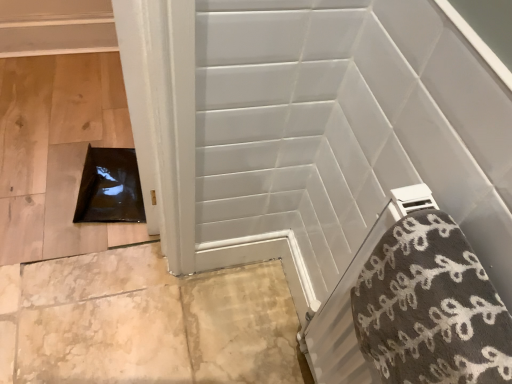
Identify the location of gray textured bath towel at lower right. (430, 308).

Describe the element at coordinates (430, 308) in the screenshot. I see `gray textured bath towel at lower right` at that location.

Locate an element on the screen. gray textured bath towel at lower right is located at coordinates (430, 308).